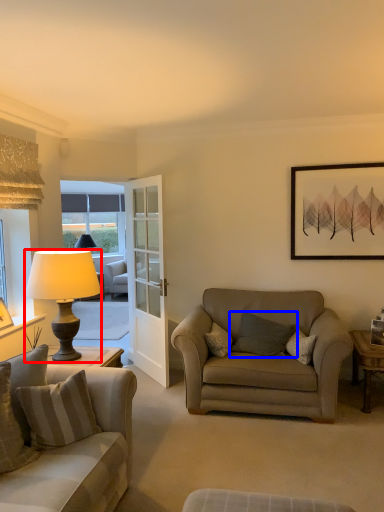
Question: Among these objects, which one is nearest to the camera, lamp (highlighted by a red box) or pillow (highlighted by a blue box)?

Choices:
 (A) lamp
 (B) pillow

Answer: (A)